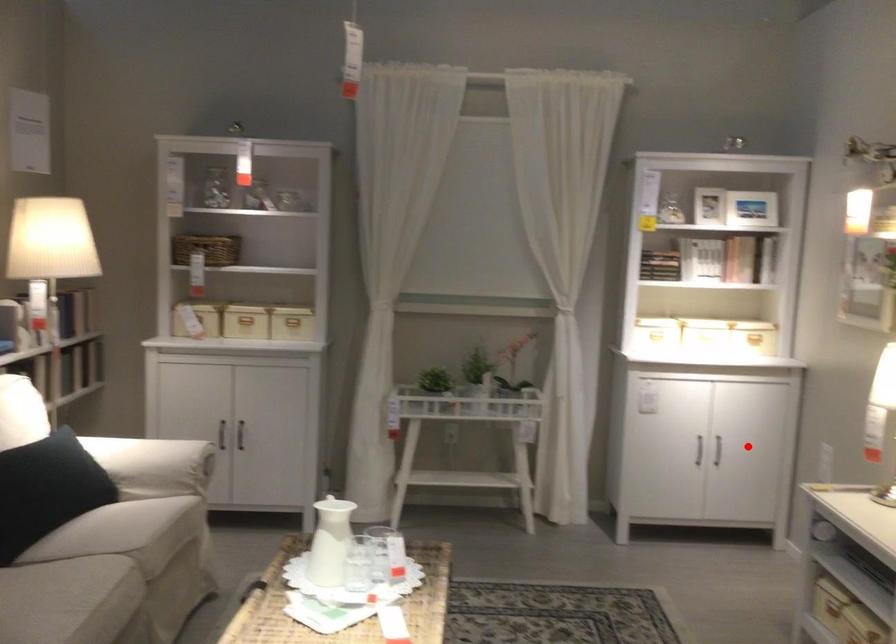
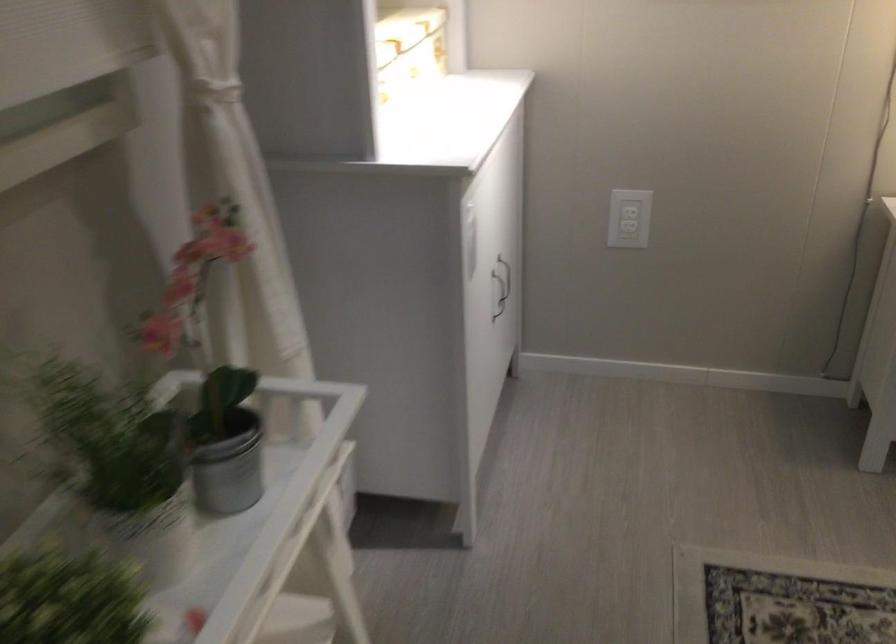
Question: I am providing you with two images of the same scene from different viewpoints. Given a red point in image1, look at the same physical point in image2. Is it:

Choices:
 (A) Closer to the viewpoint
 (B) Farther from the viewpoint

Answer: (A)